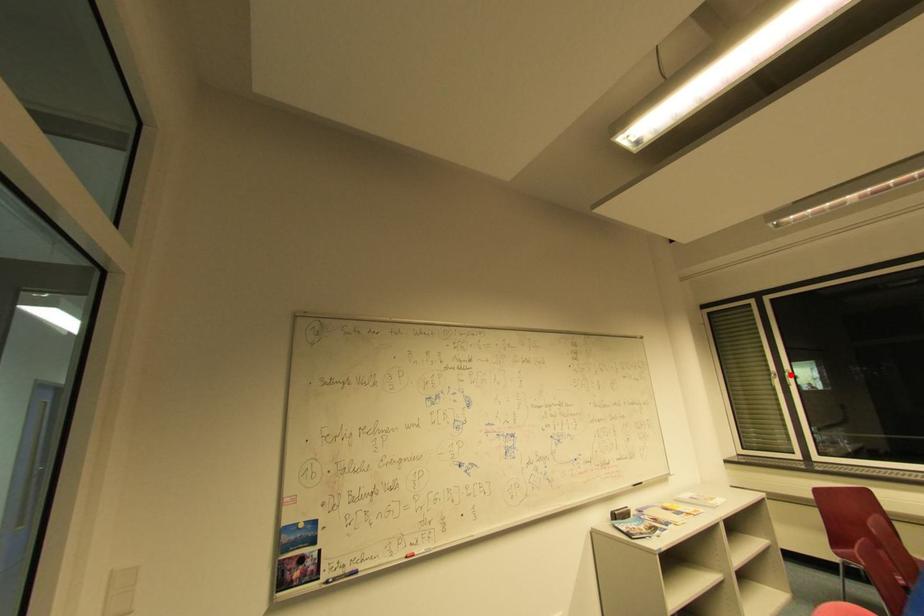
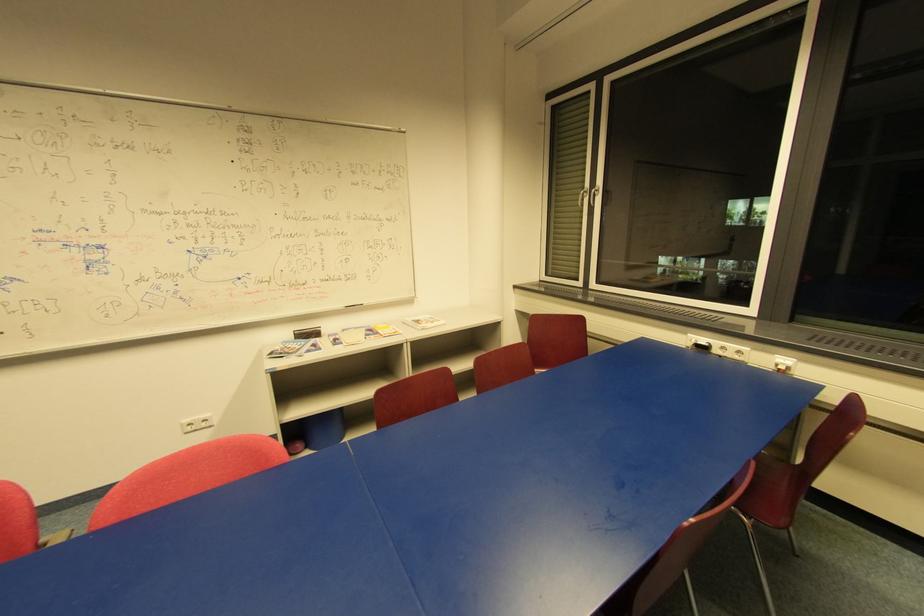
Find the pixel in the second image that matches the highlighted location in the first image.

(598, 192)